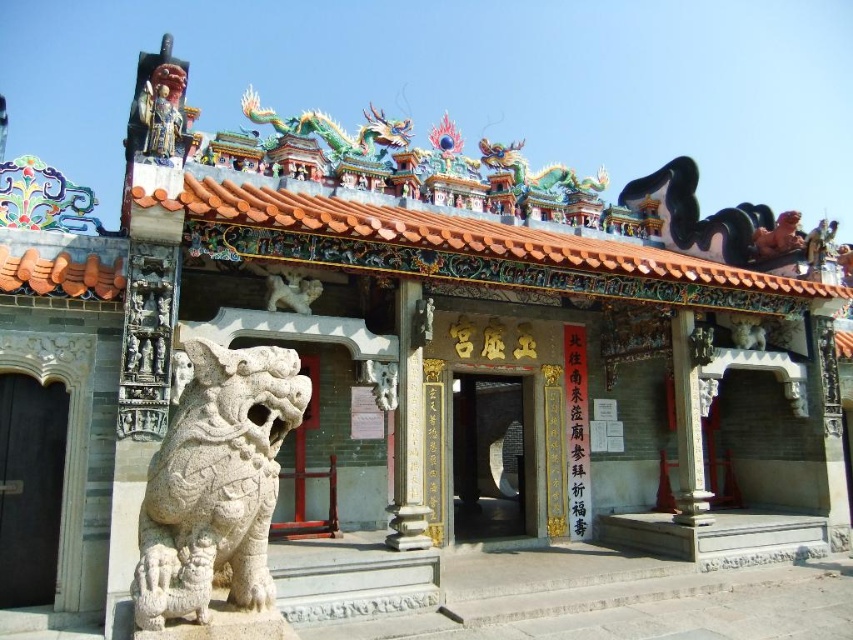
You are an architect examining the temple structure. You notice the white stone lion at lower left and the matte painted wood statue at upper left. Which of these two objects is located to the right of the other?

The white stone lion at lower left is positioned on the right side of matte painted wood statue at upper left.

Based on the photo, you are a visitor approaching the temple entrance. You see the white stone lion at lower left and the black wood door at lower left. Which object is positioned higher relative to the other?

The white stone lion at lower left is located above the black wood door at lower left, so it is positioned higher.